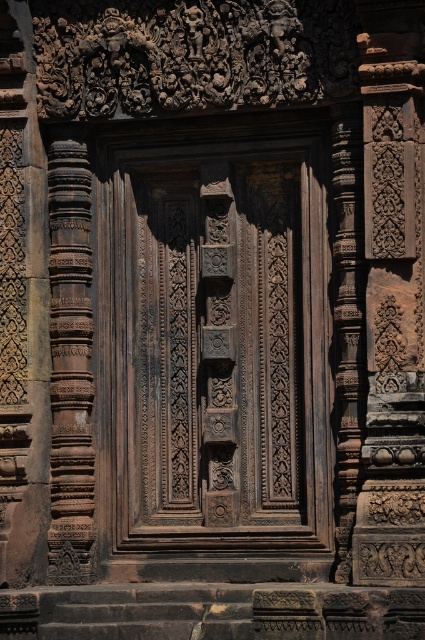
Is point (325, 262) behind point (56, 202)?

No, (325, 262) is in front of (56, 202).

Where is `dark brown wood door at center`? dark brown wood door at center is located at coordinates (214, 339).